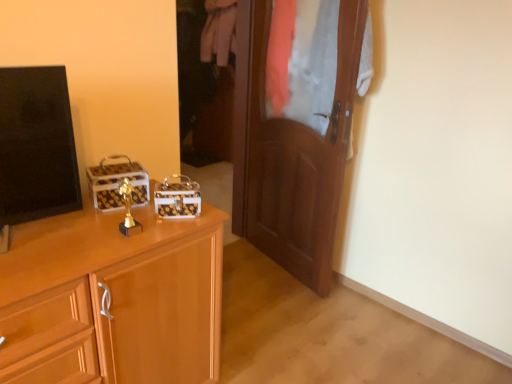
Question: From a real-world perspective, is matte wood cabinet at left below wooden door at center?

Choices:
 (A) yes
 (B) no

Answer: (A)

Question: Is matte wood cabinet at left next to wooden door at center?

Choices:
 (A) yes
 (B) no

Answer: (B)

Question: Can you confirm if matte wood cabinet at left is bigger than wooden door at center?

Choices:
 (A) yes
 (B) no

Answer: (A)

Question: From the image's perspective, does matte wood cabinet at left appear higher than wooden door at center?

Choices:
 (A) yes
 (B) no

Answer: (B)

Question: Could you tell me if matte wood cabinet at left is facing wooden door at center?

Choices:
 (A) no
 (B) yes

Answer: (A)

Question: Could wooden door at center be considered to be inside matte wood cabinet at left?

Choices:
 (A) no
 (B) yes

Answer: (A)

Question: Can you confirm if white cotton pants at center is thinner than matte wood cabinet at left?

Choices:
 (A) yes
 (B) no

Answer: (A)

Question: From a real-world perspective, is white cotton pants at center on top of matte wood cabinet at left?

Choices:
 (A) no
 (B) yes

Answer: (B)

Question: Considering the relative sizes of white cotton pants at center and matte wood cabinet at left in the image provided, is white cotton pants at center bigger than matte wood cabinet at left?

Choices:
 (A) no
 (B) yes

Answer: (A)

Question: Is white cotton pants at center further to camera compared to matte wood cabinet at left?

Choices:
 (A) yes
 (B) no

Answer: (A)

Question: From the image's perspective, would you say white cotton pants at center is positioned over matte wood cabinet at left?

Choices:
 (A) no
 (B) yes

Answer: (B)

Question: Considering the relative sizes of white cotton pants at center and matte wood cabinet at left in the image provided, is white cotton pants at center smaller than matte wood cabinet at left?

Choices:
 (A) yes
 (B) no

Answer: (A)

Question: From a real-world perspective, is matte wood cabinet at left physically below black glossy tv at left?

Choices:
 (A) yes
 (B) no

Answer: (A)